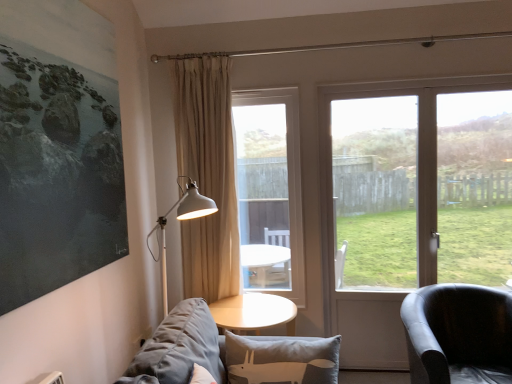
What are the coordinates of `clear glass window at center, the 1th window in the left-to-right sequence` in the screenshot? It's located at (270, 190).

At what (x,y) coordinates should I click in order to perform the action: click on gray fabric couch at lower left. Please return your answer as a coordinate pair (x, y). The height and width of the screenshot is (384, 512). Looking at the image, I should click on (229, 353).

Image resolution: width=512 pixels, height=384 pixels. Describe the element at coordinates (369, 223) in the screenshot. I see `transparent glass screen door at right` at that location.

In order to face beige fabric curtain at center, should I rotate leftwards or rightwards?

Rotate left and turn 6.669 degrees.

You are a GUI agent. You are given a task and a screenshot of the screen. Output one action in this format:
    pyautogui.click(x=<x>, y=<y>)
    Task: Click on the transparent glass door at right, which ranks as the second window in left-to-right order
    The width and height of the screenshot is (512, 384).
    Given the screenshot: What is the action you would take?
    pyautogui.click(x=387, y=156)

Considering the points (434, 192) and (248, 228), which point is in front, point (434, 192) or point (248, 228)?

The point (434, 192) is closer.

Is transparent glass door at right, which appears as the first window when viewed from the right, next to clear glass window at center, which appears as the 2th window when viewed from the right, and touching it?

There is a gap between transparent glass door at right, which appears as the first window when viewed from the right, and clear glass window at center, which appears as the 2th window when viewed from the right.

Considering the sizes of objects transparent glass door at right, which appears as the first window when viewed from the right, and clear glass window at center, the 1th window in the left-to-right sequence, in the image provided, who is bigger, transparent glass door at right, which appears as the first window when viewed from the right, or clear glass window at center, the 1th window in the left-to-right sequence,?

transparent glass door at right, which appears as the first window when viewed from the right, is bigger.

Considering the relative positions of transparent glass door at right, which appears as the first window when viewed from the right, and clear glass window at center, which appears as the 2th window when viewed from the right, in the image provided, is transparent glass door at right, which appears as the first window when viewed from the right, to the left of clear glass window at center, which appears as the 2th window when viewed from the right, from the viewer's perspective?

In fact, transparent glass door at right, which appears as the first window when viewed from the right, is to the right of clear glass window at center, which appears as the 2th window when viewed from the right.

Can you confirm if gray fabric couch at lower left is bigger than beige fabric curtain at center?

Indeed, gray fabric couch at lower left has a larger size compared to beige fabric curtain at center.

What are the coordinates of `curtain behind the gray fabric couch at lower left` in the screenshot? It's located at (208, 175).

Is gray fabric couch at lower left facing away from beige fabric curtain at center?

No, gray fabric couch at lower left is not facing away from beige fabric curtain at center.

In the scene shown: From the image's perspective, between black leather armchair at right and transparent glass screen door at right, who is located below?

From the image's view, black leather armchair at right is below.

From a real-world perspective, is black leather armchair at right located beneath transparent glass screen door at right?

Yes, from a real-world perspective, black leather armchair at right is beneath transparent glass screen door at right.

Image resolution: width=512 pixels, height=384 pixels. Find the location of `screen door behind the black leather armchair at right`. screen door behind the black leather armchair at right is located at coordinates (369, 223).

Looking at the image, does black leather armchair at right seem bigger or smaller compared to transparent glass screen door at right?

Clearly, black leather armchair at right is larger in size than transparent glass screen door at right.

Considering their positions, is beige fabric curtain at center located in front of or behind clear glass window at center, which appears as the 2th window when viewed from the right?

In the image, beige fabric curtain at center appears in front of clear glass window at center, which appears as the 2th window when viewed from the right.

What's the angular difference between beige fabric curtain at center and clear glass window at center, which appears as the 2th window when viewed from the right,'s facing directions?

The facing directions of beige fabric curtain at center and clear glass window at center, which appears as the 2th window when viewed from the right, are 0.000299 degrees apart.

Which is less distant, (231,182) or (243,143)?

The point (231,182) is closer.

Is beige fabric curtain at center next to clear glass window at center, the 1th window in the left-to-right sequence?

They are not placed beside each other.

Considering the relative sizes of transparent glass screen door at right and beige fabric curtain at center in the image provided, is transparent glass screen door at right taller than beige fabric curtain at center?

Indeed, transparent glass screen door at right has a greater height compared to beige fabric curtain at center.

Can you confirm if transparent glass screen door at right is positioned to the right of beige fabric curtain at center?

Correct, you'll find transparent glass screen door at right to the right of beige fabric curtain at center.

Are transparent glass screen door at right and beige fabric curtain at center beside each other?

No, transparent glass screen door at right is not in contact with beige fabric curtain at center.

Considering the relative sizes of transparent glass screen door at right and beige fabric curtain at center in the image provided, is transparent glass screen door at right wider than beige fabric curtain at center?

No.

Does beige fabric curtain at center have a greater width compared to transparent glass door at right, which ranks as the second window in left-to-right order?

Yes.

Is beige fabric curtain at center aimed at transparent glass door at right, which ranks as the second window in left-to-right order?

No, beige fabric curtain at center is not facing towards transparent glass door at right, which ranks as the second window in left-to-right order.

Locate an element on the screen. Image resolution: width=512 pixels, height=384 pixels. curtain above the transparent glass door at right, which appears as the first window when viewed from the right (from the image's perspective) is located at coordinates (208, 175).

Considering the sizes of objects beige fabric curtain at center and transparent glass screen door at right in the image provided, who is shorter, beige fabric curtain at center or transparent glass screen door at right?

beige fabric curtain at center.

Is beige fabric curtain at center positioned far away from transparent glass screen door at right?

Yes, beige fabric curtain at center and transparent glass screen door at right are located far from each other.

Can you confirm if beige fabric curtain at center is positioned to the right of transparent glass screen door at right?

In fact, beige fabric curtain at center is to the left of transparent glass screen door at right.

Consider the image. Which object is closer to the camera taking this photo, beige fabric curtain at center or transparent glass screen door at right?

Positioned in front is beige fabric curtain at center.

I want to click on window above the transparent glass door at right, which appears as the first window when viewed from the right (from a real-world perspective), so click(x=270, y=190).

Locate an element on the screen. studio couch lying on the right of beige fabric curtain at center is located at coordinates (229, 353).

Based on their spatial positions, is transparent glass screen door at right or gray fabric couch at lower left closer to transparent glass door at right, which ranks as the second window in left-to-right order?

Based on the image, transparent glass screen door at right appears to be nearer to transparent glass door at right, which ranks as the second window in left-to-right order.

From the image, which object appears to be nearer to black leather armchair at right, beige fabric curtain at center or gray fabric couch at lower left?

gray fabric couch at lower left is positioned closer to the anchor black leather armchair at right.

When comparing their distances from transparent glass screen door at right, does transparent glass door at right, which ranks as the second window in left-to-right order, or clear glass window at center, the 1th window in the left-to-right sequence, seem further?

Among the two, clear glass window at center, the 1th window in the left-to-right sequence, is located further to transparent glass screen door at right.

Considering their positions, is beige fabric curtain at center positioned closer to black leather armchair at right than clear glass window at center, which appears as the 2th window when viewed from the right?

beige fabric curtain at center.

When comparing their distances from clear glass window at center, the 1th window in the left-to-right sequence, does black leather armchair at right or gray fabric couch at lower left seem closer?

Based on the image, black leather armchair at right appears to be nearer to clear glass window at center, the 1th window in the left-to-right sequence.

Looking at the image, which one is located closer to beige fabric curtain at center, clear glass window at center, the 1th window in the left-to-right sequence, or transparent glass screen door at right?

transparent glass screen door at right lies closer to beige fabric curtain at center than the other object.

Which object lies further to the anchor point beige fabric curtain at center, gray fabric couch at lower left or clear glass window at center, which appears as the 2th window when viewed from the right?

Among the two, clear glass window at center, which appears as the 2th window when viewed from the right, is located further to beige fabric curtain at center.

From the image, which object appears to be farther from transparent glass door at right, which ranks as the second window in left-to-right order, transparent glass screen door at right or beige fabric curtain at center?

beige fabric curtain at center is further to transparent glass door at right, which ranks as the second window in left-to-right order.

The width and height of the screenshot is (512, 384). Find the location of `curtain between gray fabric couch at lower left and clear glass window at center, which appears as the 2th window when viewed from the right, along the z-axis`. curtain between gray fabric couch at lower left and clear glass window at center, which appears as the 2th window when viewed from the right, along the z-axis is located at coordinates (208, 175).

Find the location of `window between black leather armchair at right and transparent glass screen door at right along the z-axis`. window between black leather armchair at right and transparent glass screen door at right along the z-axis is located at coordinates (387, 156).

At what (x,y) coordinates should I click in order to perform the action: click on screen door positioned between gray fabric couch at lower left and clear glass window at center, the 1th window in the left-to-right sequence, from near to far. Please return your answer as a coordinate pair (x, y). Looking at the image, I should click on (369, 223).

Image resolution: width=512 pixels, height=384 pixels. Find the location of `studio couch between beige fabric curtain at center and black leather armchair at right in the horizontal direction`. studio couch between beige fabric curtain at center and black leather armchair at right in the horizontal direction is located at coordinates (229, 353).